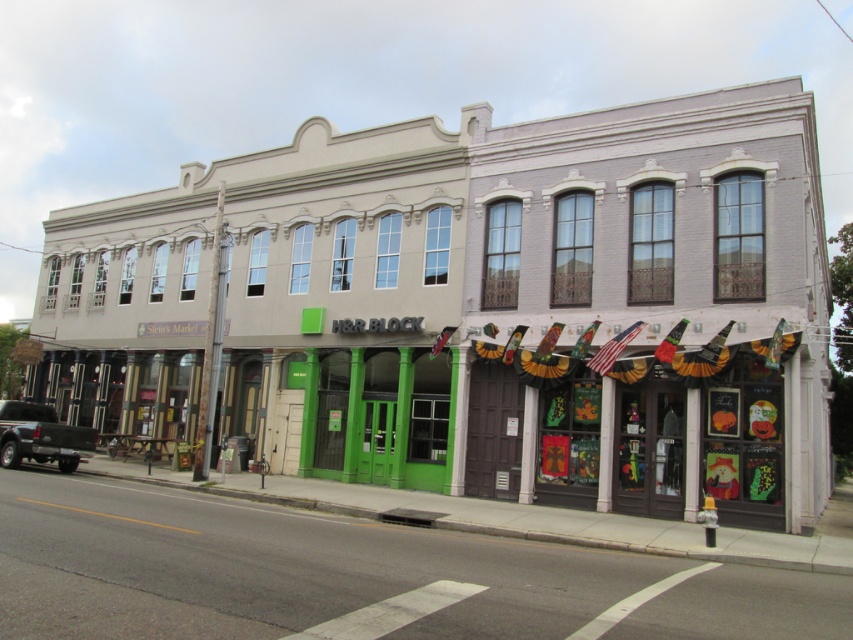
Does white brick building at center appear over matte black truck at lower left?

Correct, white brick building at center is located above matte black truck at lower left.

Describe the element at coordinates (479, 307) in the screenshot. I see `white brick building at center` at that location.

Is point (646, 394) farther from viewer compared to point (22, 404)?

That is False.

Where is `white brick building at center`? This screenshot has height=640, width=853. white brick building at center is located at coordinates (479, 307).